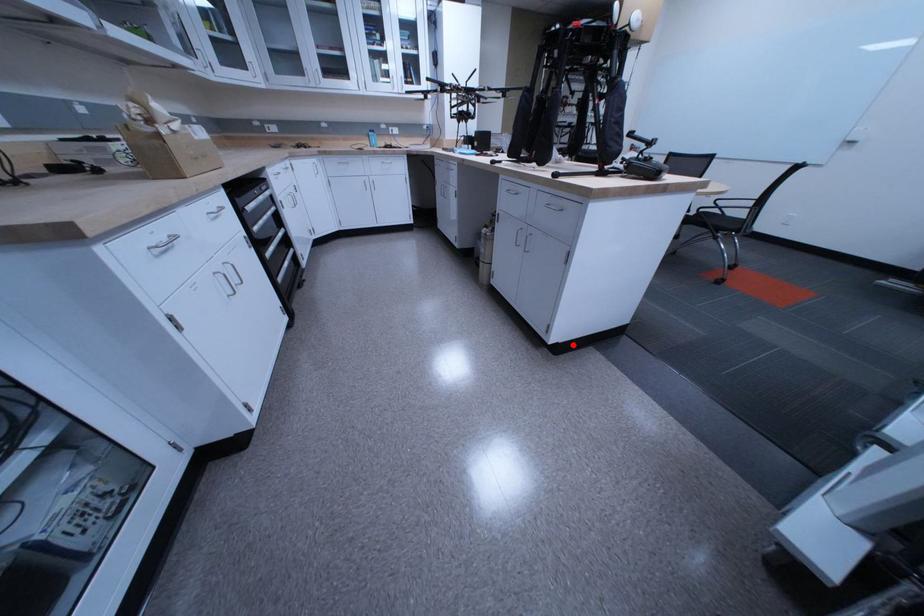
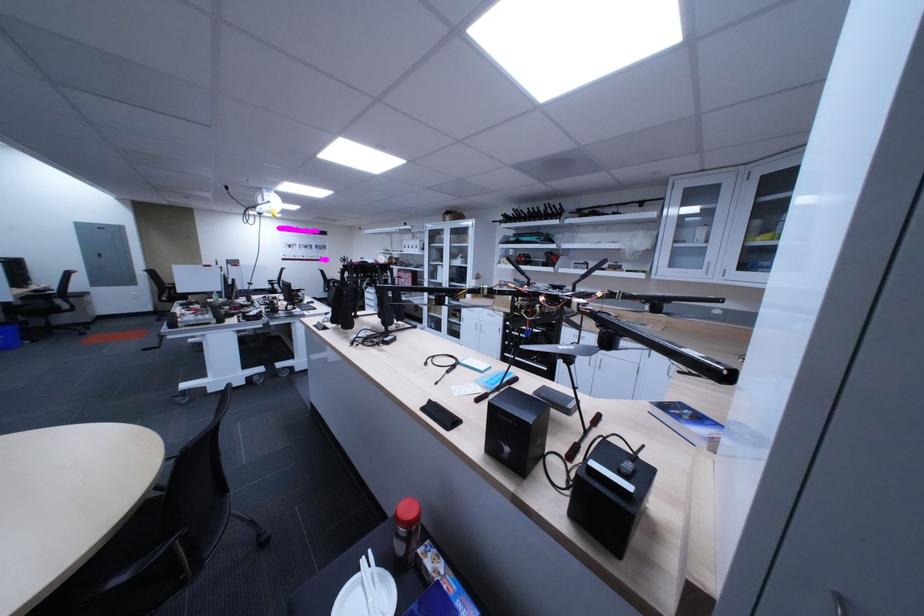
Question: I am providing you with two images of the same scene from different viewpoints. A red point is marked on the first image. Is the red point's position out of view in image 2?

Choices:
 (A) Yes
 (B) No

Answer: (A)